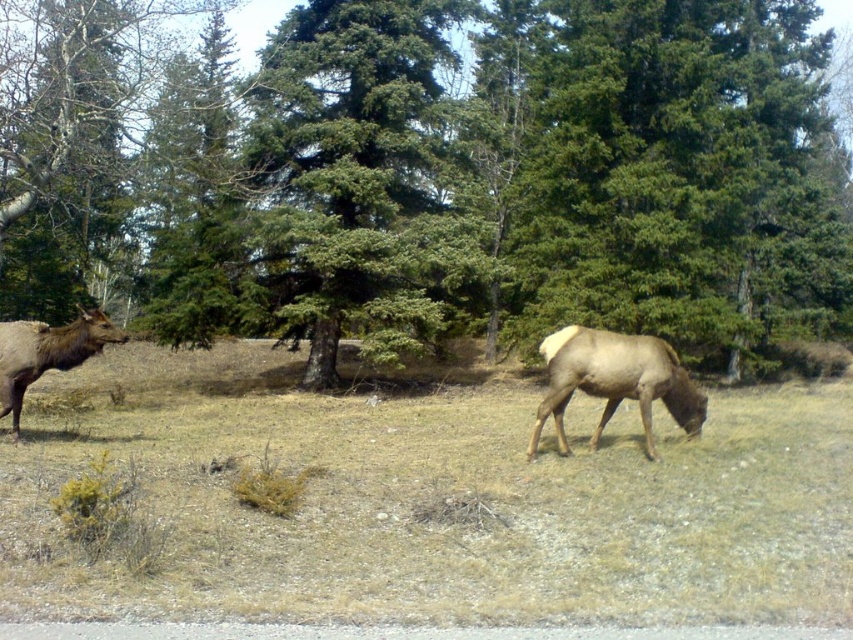
Question: Which point is farther to the camera?

Choices:
 (A) (572, 326)
 (B) (38, 547)

Answer: (A)

Question: Does green leafy tree at center appear over brown fur at center?

Choices:
 (A) no
 (B) yes

Answer: (B)

Question: Which object appears closest to the camera in this image?

Choices:
 (A) green leafy tree at center
 (B) brown fur at center
 (C) brown matte/deer at center
 (D) brown velvet deer at left

Answer: (B)

Question: Is brown matte/deer at center below brown velvet deer at left?

Choices:
 (A) no
 (B) yes

Answer: (B)

Question: In this image, where is green leafy tree at center located relative to brown velvet deer at left?

Choices:
 (A) right
 (B) left

Answer: (A)

Question: Which object appears farthest from the camera in this image?

Choices:
 (A) brown velvet deer at left
 (B) brown fur at center
 (C) green leafy tree at center
 (D) brown matte/deer at center

Answer: (C)